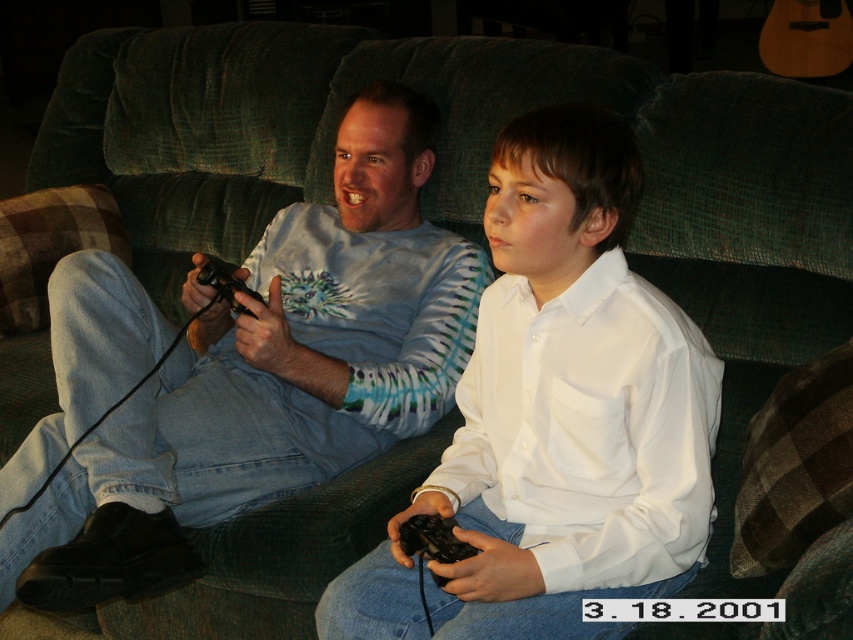
Question: Can you confirm if tie-dye long-sleeve shirt at center is positioned to the left of white matte shirt at center?

Choices:
 (A) yes
 (B) no

Answer: (A)

Question: Can you confirm if tie-dye long-sleeve shirt at center is positioned to the right of white matte shirt at center?

Choices:
 (A) yes
 (B) no

Answer: (B)

Question: Is tie-dye long-sleeve shirt at center in front of white matte shirt at center?

Choices:
 (A) no
 (B) yes

Answer: (A)